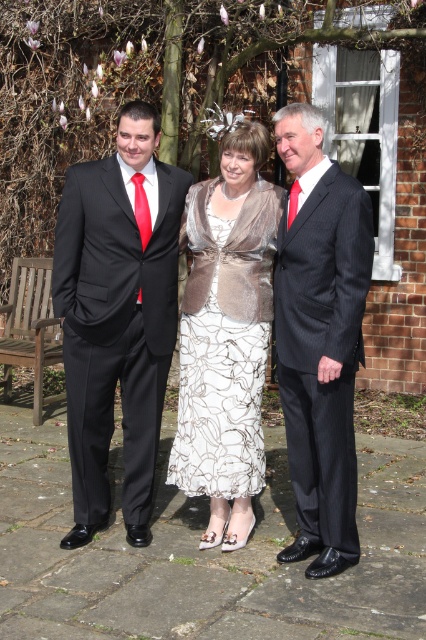
Does silver textured dress at center appear on the left side of wooden park bench at left?

Incorrect, silver textured dress at center is not on the left side of wooden park bench at left.

Does silver textured dress at center appear over wooden park bench at left?

No.

In order to click on silver textured dress at center in this screenshot , I will do `click(224, 342)`.

Between matte black suit at left and wooden park bench at left, which one is positioned higher?

matte black suit at left is higher up.

Who is more forward, (x=149, y=211) or (x=13, y=285)?

Point (x=149, y=211) is more forward.

Does point (81, 211) come closer to viewer compared to point (2, 312)?

That is True.

Locate an element on the screen. matte black suit at left is located at coordinates (118, 316).

Can you confirm if matte black suit at left is positioned to the right of dark gray pinstripe suit at center?

In fact, matte black suit at left is to the left of dark gray pinstripe suit at center.

Does matte black suit at left have a smaller size compared to dark gray pinstripe suit at center?

No, matte black suit at left is not smaller than dark gray pinstripe suit at center.

Who is more distant from viewer, (143, 364) or (350, 445)?

The point (143, 364) is more distant.

Where is `matte black suit at left`? This screenshot has width=426, height=640. matte black suit at left is located at coordinates (118, 316).